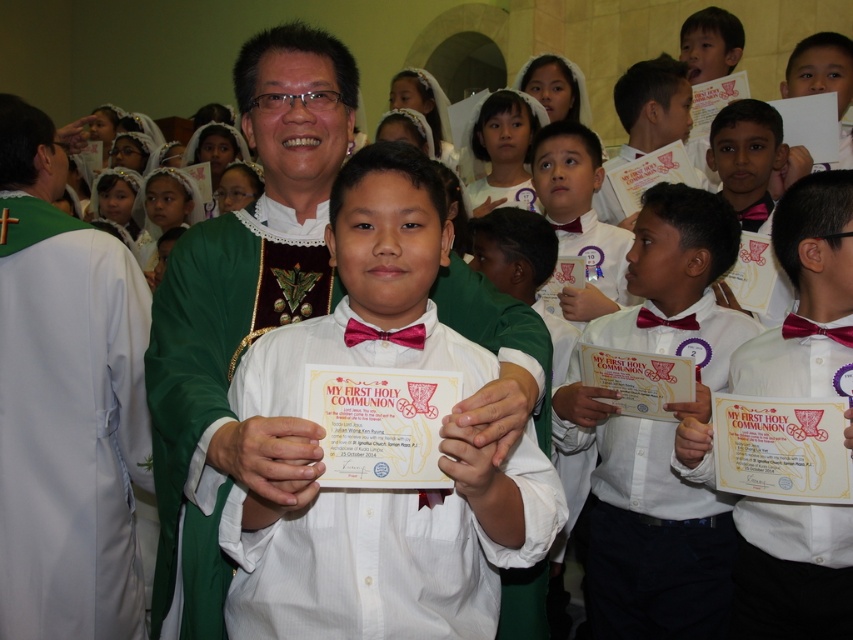
Question: Does white glossy bow tie at center lie behind white paper certificate at center?

Choices:
 (A) yes
 (B) no

Answer: (B)

Question: Among these points, which one is farthest from the camera?

Choices:
 (A) (386, 332)
 (B) (630, 129)
 (C) (61, 163)
 (D) (836, 620)

Answer: (B)

Question: Which of the following is the farthest from the observer?

Choices:
 (A) white satin robe at left
 (B) purple satin bow tie at center
 (C) white glossy shirt at center
 (D) white paper certificate at center

Answer: (D)

Question: Which point appears closest to the camera in this image?

Choices:
 (A) (102, 276)
 (B) (775, 577)
 (C) (648, 321)
 (D) (384, 332)

Answer: (D)

Question: Can you confirm if white glossy bow tie at center is positioned above purple satin bow tie at center?

Choices:
 (A) no
 (B) yes

Answer: (B)

Question: Is white glossy bow tie at center bigger than white paper certificate at center?

Choices:
 (A) yes
 (B) no

Answer: (B)